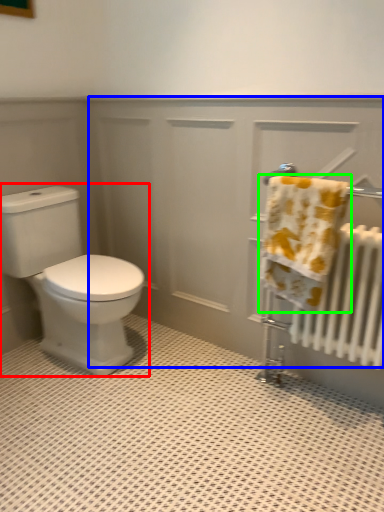
Question: Estimate the real-world distances between objects in this image. Which object is farther from toilet (highlighted by a red box), screen door (highlighted by a blue box) or towel (highlighted by a green box)?

Choices:
 (A) screen door
 (B) towel

Answer: (B)